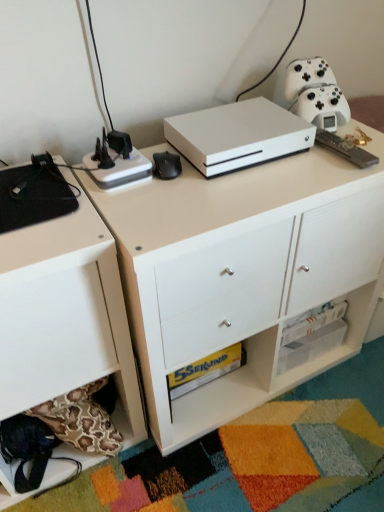
You are a GUI agent. You are given a task and a screenshot of the screen. Output one action in this format:
    pyautogui.click(x=<x>, y=<y>)
    Task: Click on the vacant space in front of white matte gaming console at center, which ranks as the 3th appliance in left-to-right order
    
    Given the screenshot: What is the action you would take?
    233,193